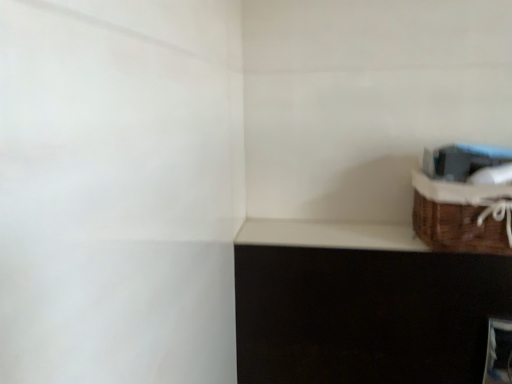
Question: Is brown woven basket at upper right directly adjacent to white matte window sill at upper right?

Choices:
 (A) no
 (B) yes

Answer: (B)

Question: From the image's perspective, is brown woven basket at upper right under white matte window sill at upper right?

Choices:
 (A) yes
 (B) no

Answer: (B)

Question: Is brown woven basket at upper right oriented away from white matte window sill at upper right?

Choices:
 (A) yes
 (B) no

Answer: (B)

Question: Is brown woven basket at upper right further to camera compared to white matte window sill at upper right?

Choices:
 (A) no
 (B) yes

Answer: (A)

Question: Considering the relative positions of brown woven basket at upper right and white matte window sill at upper right in the image provided, is brown woven basket at upper right to the left of white matte window sill at upper right from the viewer's perspective?

Choices:
 (A) yes
 (B) no

Answer: (B)

Question: From the image's perspective, would you say brown woven basket at upper right is positioned over white matte window sill at upper right?

Choices:
 (A) no
 (B) yes

Answer: (B)

Question: Considering the relative sizes of white matte window sill at upper right and brown woven basket at upper right in the image provided, is white matte window sill at upper right taller than brown woven basket at upper right?

Choices:
 (A) no
 (B) yes

Answer: (A)

Question: Is brown woven basket at upper right at the back of white matte window sill at upper right?

Choices:
 (A) yes
 (B) no

Answer: (B)

Question: Considering the relative sizes of white matte window sill at upper right and brown woven basket at upper right in the image provided, is white matte window sill at upper right shorter than brown woven basket at upper right?

Choices:
 (A) yes
 (B) no

Answer: (A)

Question: From a real-world perspective, is white matte window sill at upper right physically below brown woven basket at upper right?

Choices:
 (A) no
 (B) yes

Answer: (B)

Question: Is white matte window sill at upper right wider than brown woven basket at upper right?

Choices:
 (A) no
 (B) yes

Answer: (A)

Question: Considering the relative sizes of white matte window sill at upper right and brown woven basket at upper right in the image provided, is white matte window sill at upper right smaller than brown woven basket at upper right?

Choices:
 (A) yes
 (B) no

Answer: (A)

Question: Is brown woven basket at upper right in front of or behind white matte window sill at upper right in the image?

Choices:
 (A) behind
 (B) front

Answer: (B)